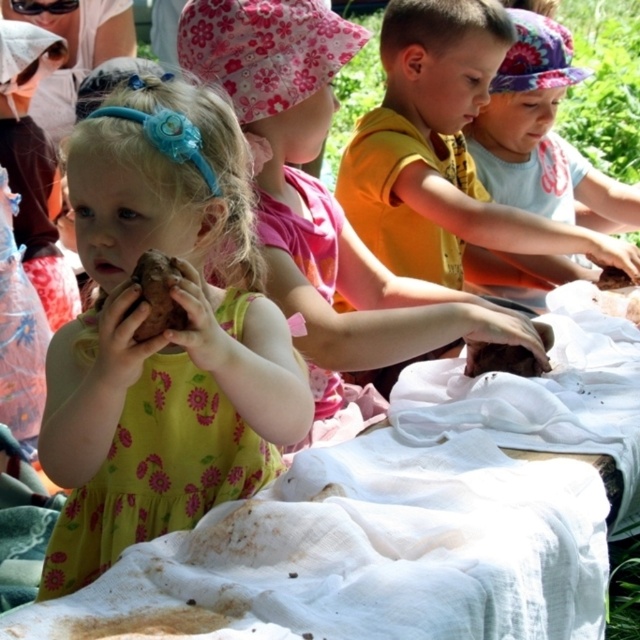
Question: Which object appears farthest from the camera in this image?

Choices:
 (A) smooth brown clay at center
 (B) white cloth at center

Answer: (A)

Question: Does yellow floral dress at center have a lesser width compared to brown matte potato at center?

Choices:
 (A) no
 (B) yes

Answer: (A)

Question: Does white cloth at center appear on the right side of smooth brown clay at center?

Choices:
 (A) no
 (B) yes

Answer: (A)

Question: Based on their relative distances, which object is nearer to the matte brown potato at center?

Choices:
 (A) yellow floral dress at center
 (B) brown matte clay at center
 (C) brown matte potato at center
 (D) white cloth at center

Answer: (C)

Question: Is smooth brown clay at center to the right of brown matte clay at center from the viewer's perspective?

Choices:
 (A) no
 (B) yes

Answer: (B)

Question: Which point appears farthest from the camera in this image?

Choices:
 (A) (285, 308)
 (B) (552, 337)
 (C) (378, 113)
 (D) (422, 476)

Answer: (C)